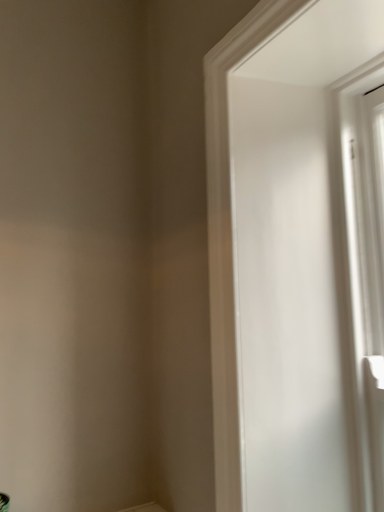
This screenshot has height=512, width=384. I want to click on white glossy door at right, so click(298, 256).

The image size is (384, 512). Describe the element at coordinates (298, 256) in the screenshot. I see `white glossy door at right` at that location.

Find the location of `white glossy door at right`. white glossy door at right is located at coordinates point(298,256).